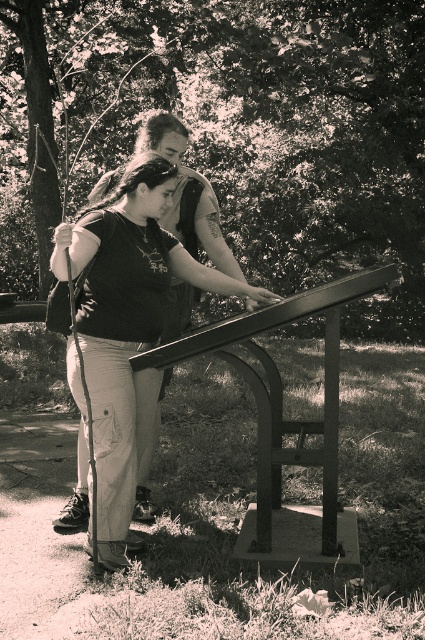
You are standing at the point with coordinates point (144,166) and want to get to the point with coordinates point (269,502). Is there a clear path between them?

Point (144,166) is behind point (269,502), so there is no clear path between them because the point (269,502) is blocking the way.